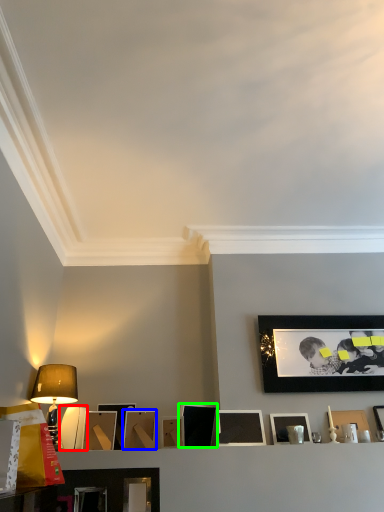
Question: Which object is positioned farthest from picture frame (highlighted by a red box)? Select from picture frame (highlighted by a blue box) and picture frame (highlighted by a green box).

Choices:
 (A) picture frame
 (B) picture frame

Answer: (B)